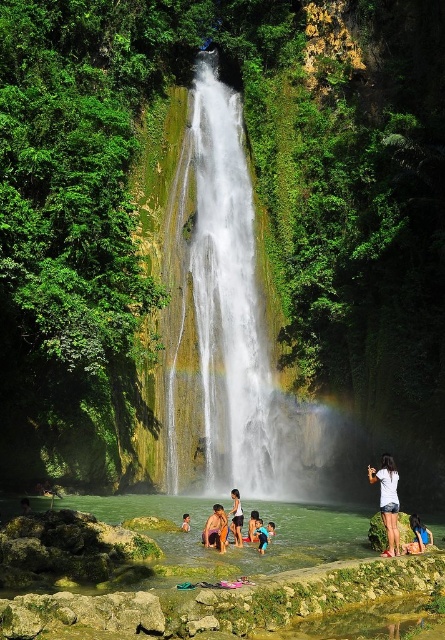
Question: Is clear water at lower center wider than white cotton shorts at lower right?

Choices:
 (A) yes
 (B) no

Answer: (A)

Question: Is clear water at lower center below blue wetsuit child at lower center?

Choices:
 (A) no
 (B) yes

Answer: (B)

Question: Which of these objects is positioned farthest from the blue fabric swimsuit at lower center?

Choices:
 (A) pink swim trunks at lower center
 (B) blue wetsuit child at lower center
 (C) light blue shorts at center
 (D) white cotton shorts at lower right

Answer: (D)

Question: Which point appears closest to the camera in this image?

Choices:
 (A) (268, 536)
 (B) (218, 545)
 (C) (259, 552)
 (D) (247, 552)

Answer: (B)

Question: Can you confirm if white cotton shorts at lower right is positioned to the right of blue fabric swimsuit at lower center?

Choices:
 (A) no
 (B) yes

Answer: (B)

Question: Which point appears farthest from the camera in this image?

Choices:
 (A) (267, 531)
 (B) (234, 518)
 (C) (124, 582)
 (D) (267, 524)

Answer: (D)